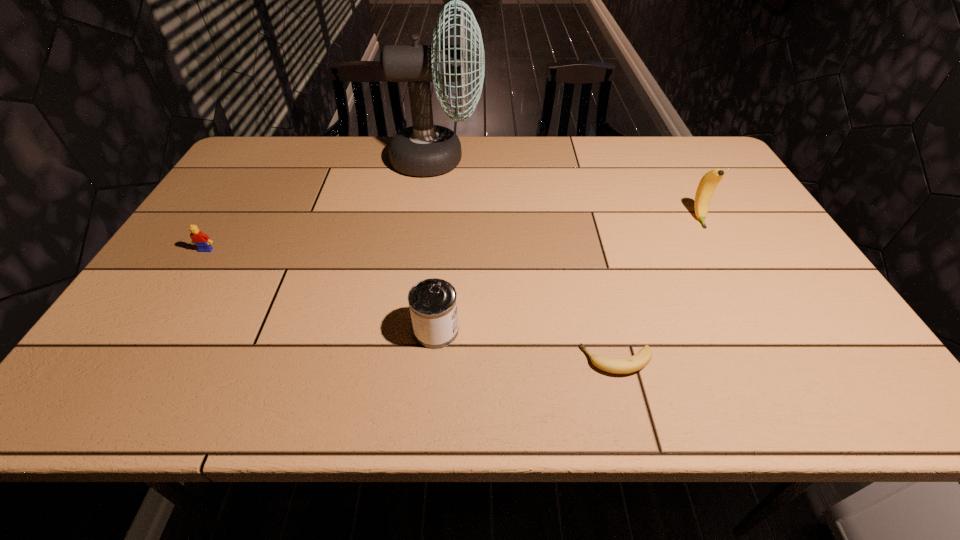
You are a GUI agent. You are given a task and a screenshot of the screen. Output one action in this format:
    pyautogui.click(x=<x>, y=<y>)
    Task: Click on the free space in the image that satisfies the following two spatial constraints: 1. from the stem of the second tallest object; 2. at the stem of the second object from right to left
    
    Given the screenshot: What is the action you would take?
    pyautogui.click(x=778, y=361)